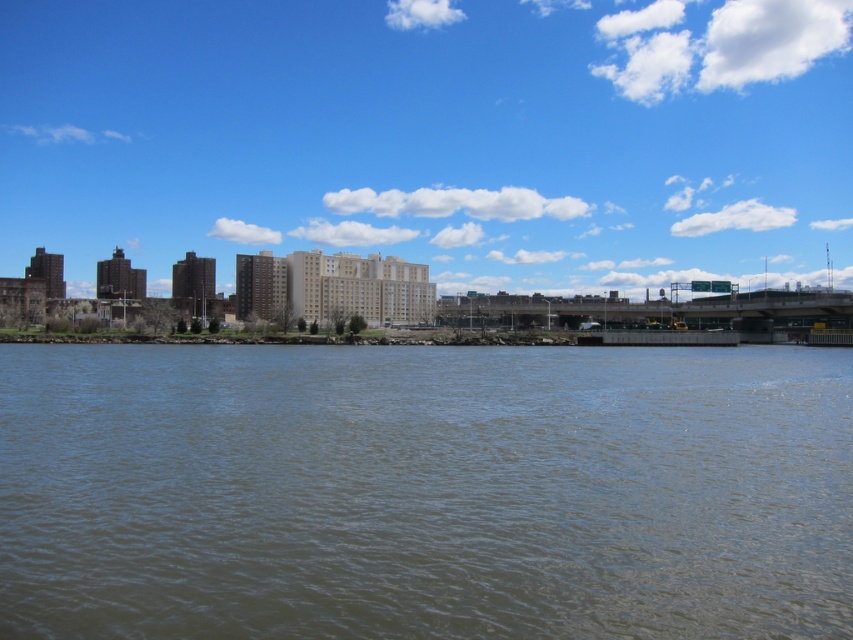
You are standing at the point with coordinates 0.5, 0.5 in the image. Which direction should you move to reach the brown water at lower center?

The brown water at lower center is located at point (424,492). Since your current position is at (426,320), you should move to the right and slightly downward to reach it.

Looking at this image, you are standing at the edge of the water and want to take a photo of both the brown water at lower center and the matte concrete buildings at center. Which object should you focus on first to ensure it appears sharp in the photo?

You should focus on the brown water at lower center first because it is closer to the viewer than the matte concrete buildings at center, so focusing on the closer object ensures it will be sharp.

You are a photographer planning to capture the entire scene of the matte concrete buildings at center and the brown water at lower center in one shot. Based on their sizes, which object would you need to focus on more carefully to ensure both are clearly visible in the photograph?

Answer: The matte concrete buildings at center are larger than the brown water at lower center, so focusing on the matte concrete buildings at center would help ensure both are clearly visible in the photograph.